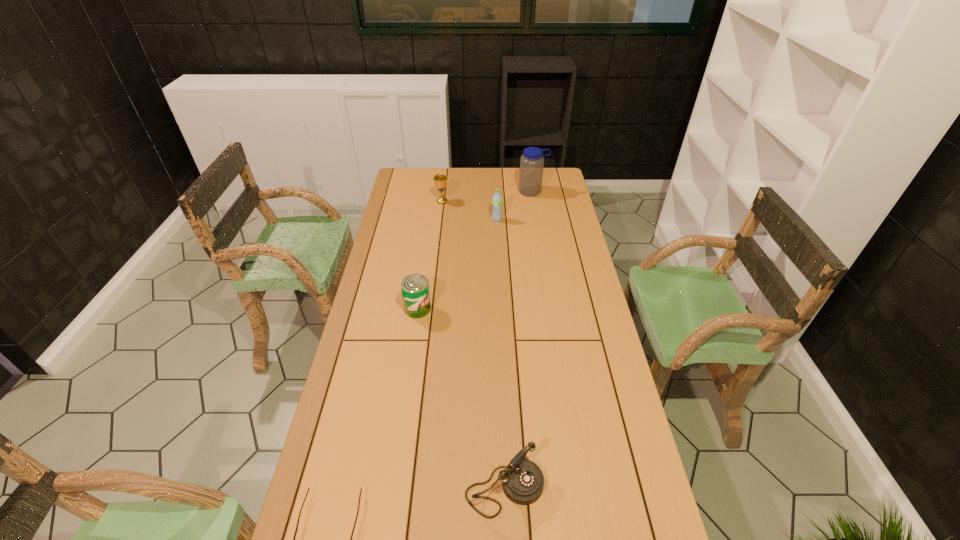
Where is `free space located on the front of the fourth farthest object`? This screenshot has height=540, width=960. free space located on the front of the fourth farthest object is located at coordinates (408, 374).

You are a GUI agent. You are given a task and a screenshot of the screen. Output one action in this format:
    pyautogui.click(x=<x>, y=<y>)
    Task: Click on the vacant space located 0.350m on the left of the telephone
    
    Given the screenshot: What is the action you would take?
    pyautogui.click(x=329, y=488)

Find the location of `object situated at the far edge`. object situated at the far edge is located at coordinates (532, 161).

At what (x,y) coordinates should I click in order to perform the action: click on object that is at the left edge. Please return your answer as a coordinate pair (x, y). Looking at the image, I should click on (415, 289).

This screenshot has width=960, height=540. What are the coordinates of `object that is at the right edge` in the screenshot? It's located at (532, 161).

The width and height of the screenshot is (960, 540). I want to click on object that is at the far right corner, so click(x=532, y=161).

Image resolution: width=960 pixels, height=540 pixels. In order to click on free space at the left edge in this screenshot , I will do `click(410, 199)`.

Locate an element on the screen. The width and height of the screenshot is (960, 540). free space at the right edge of the desktop is located at coordinates (591, 383).

This screenshot has width=960, height=540. Find the location of `free area in between the telephone and the nearer water bottle`. free area in between the telephone and the nearer water bottle is located at coordinates (500, 354).

Locate an element on the screen. The width and height of the screenshot is (960, 540). free point between the telephone and the second farthest object is located at coordinates (473, 345).